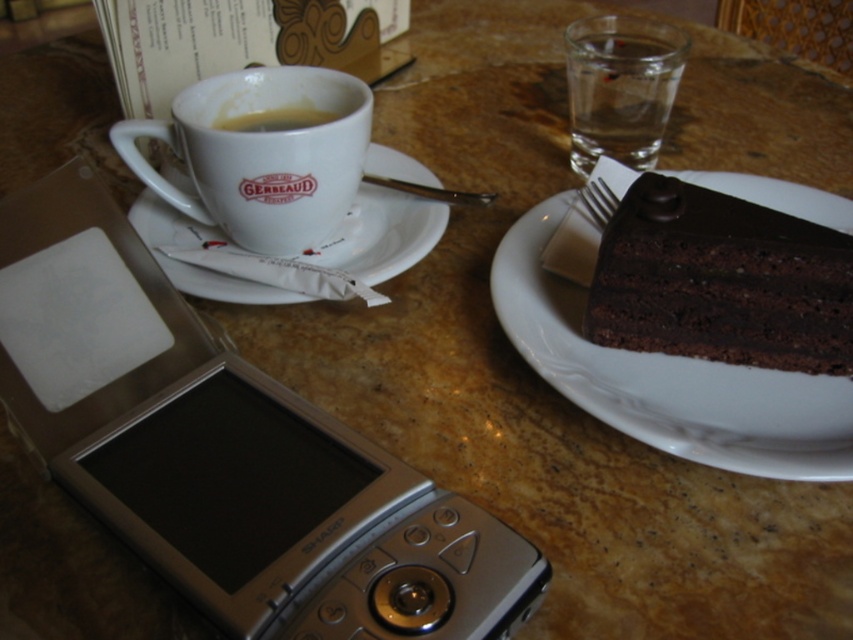
You are a customer at the Gerbeaud cafe and want to place your phone on the table. The phone is 15 cm long. The table has a marble surface. Where should you place your phone so that it doesn not block the clear glass water at upper right?

Place the phone on the table away from the clear glass water at upper right, which is located at coordinates (619, 88). Since the phone is 15 cm long, ensure there is enough space around the water glass to avoid blocking it.

In the scene shown: What is located at the coordinates point [721,282] in the image?

The point [721,282] is on dark chocolate cake at right.